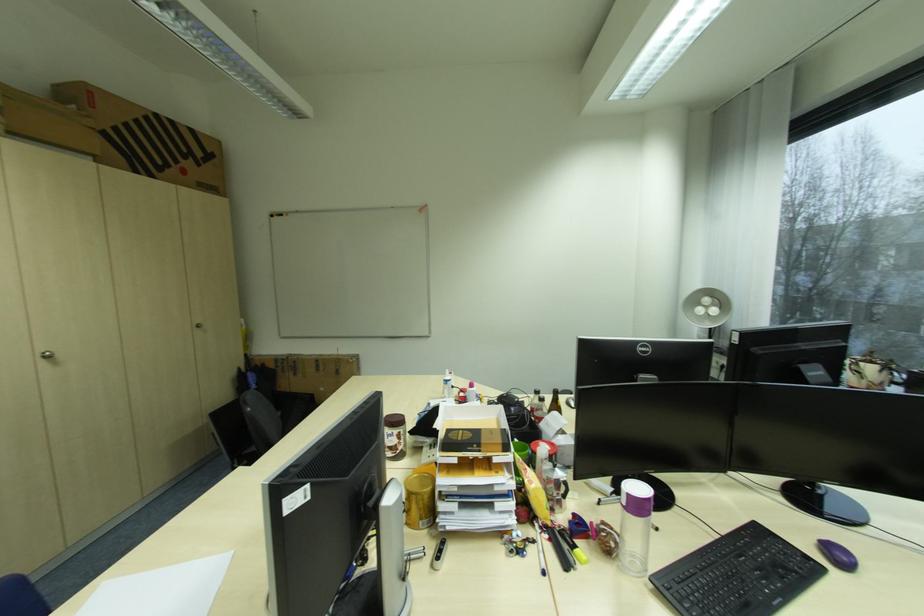
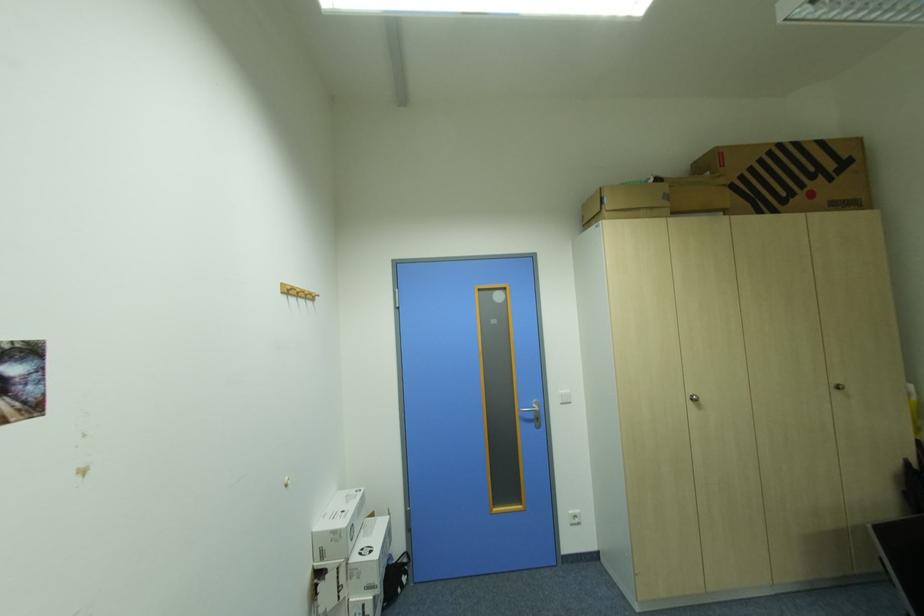
Locate, in the second image, the point that corresponds to [49,357] in the first image.

(697, 399)